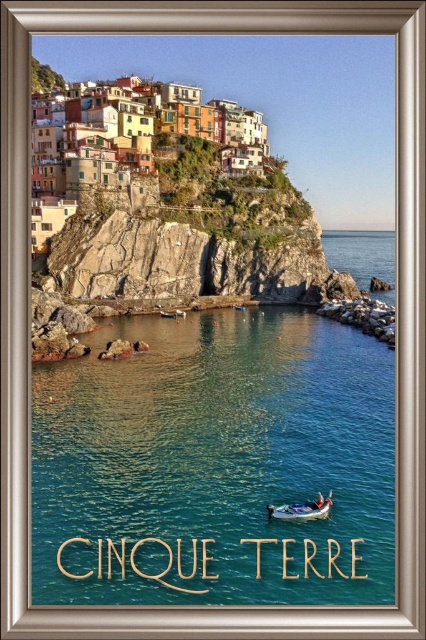
Does point (54, 378) come farther from viewer compared to point (319, 502)?

Yes, it is behind point (319, 502).

Is point (293, 428) farther from camera compared to point (305, 516)?

Yes, it is behind point (305, 516).

You are a GUI agent. You are given a task and a screenshot of the screen. Output one action in this format:
    pyautogui.click(x=<x>, y=<y>)
    Task: Click on the clear blue water at center
    
    Given the screenshot: What is the action you would take?
    pyautogui.click(x=215, y=465)